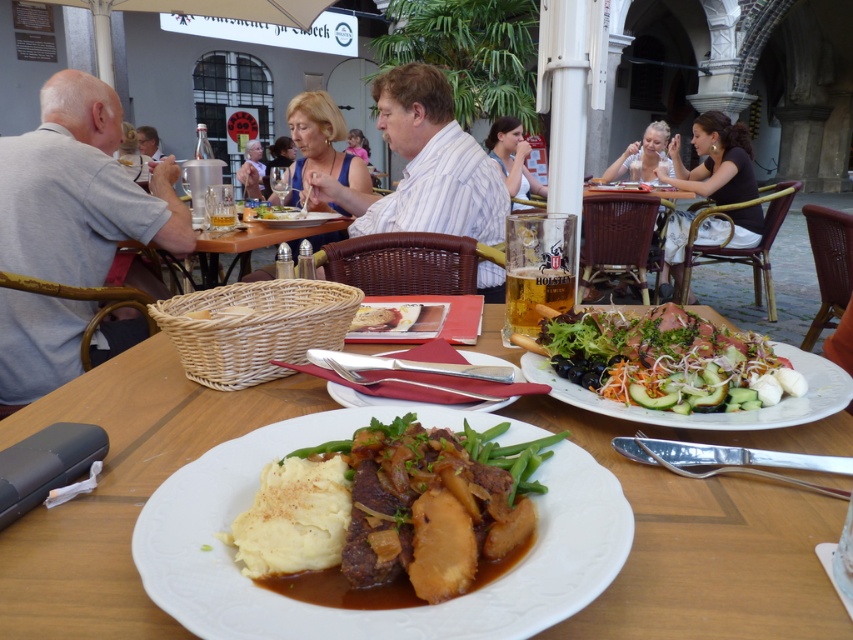
You are standing at the entrance of the outdoor dining area and want to find the matte blue dress at center. Based on the coordinates provided, in which direction should you look to locate it?

The matte blue dress at center is located at coordinates point (321, 145), which would be towards the lower left area of the dining area from your current position at the entrance.

From the picture: You are a customer sitting at the table in the image. You want to order a drink from the server who is standing at the point marked by coordinates point (x=424, y=164). Can you reach the server by moving straight forward from your current position?

The point (x=424, y=164) marks the striped cotton shirt at center, which is where the server is standing. Since you are sitting at the table in the image, moving straight forward would take you directly towards the server at the striped cotton shirt at center, so yes, you can reach them by moving straight forward.

You are a customer sitting at the table and want to reach the slightly browned bread at center without getting up. The blonde hair at upper center is in your line of sight. Can you still reach the bread?

The blonde hair at upper center is 3.78 meters away from slightly browned bread at center. Since the distance between them is quite large, you would need to get up to reach the bread, so you cannot reach it while staying seated.